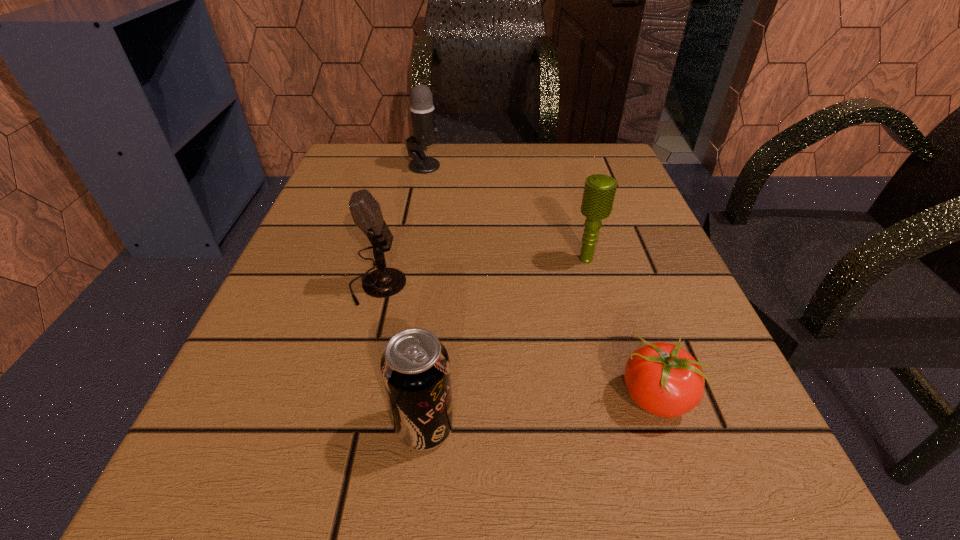
Identify the location of vacant space situated on the back of the tomato. (590, 209).

Identify the location of object located in the far edge section of the desktop. (422, 110).

Where is `object situated at the near edge`? This screenshot has width=960, height=540. object situated at the near edge is located at coordinates (415, 368).

The height and width of the screenshot is (540, 960). Identify the location of microphone located at the right edge. click(599, 192).

Locate an element on the screen. The width and height of the screenshot is (960, 540). tomato present at the right edge is located at coordinates (663, 379).

You are a GUI agent. You are given a task and a screenshot of the screen. Output one action in this format:
    pyautogui.click(x=<x>, y=<y>)
    Task: Click on the object at the far left corner
    
    Given the screenshot: What is the action you would take?
    (x=422, y=110)

Locate an element on the screen. vacant space at the far edge of the desktop is located at coordinates click(432, 178).

Find the location of a particular element. The width and height of the screenshot is (960, 540). free point at the near edge is located at coordinates (419, 469).

Identify the location of free spot at the left edge of the desktop. (367, 325).

In order to click on vacant space at the right edge of the desktop in this screenshot , I will do `click(641, 304)`.